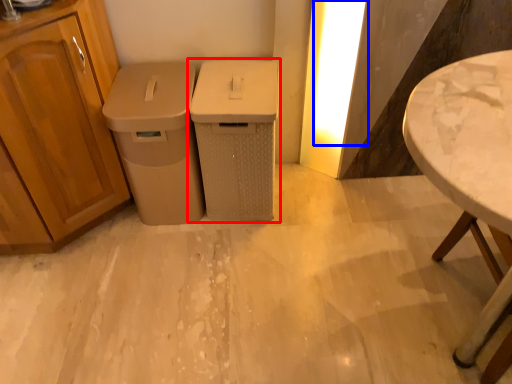
Question: Which object is further to the camera taking this photo, waste container (highlighted by a red box) or light (highlighted by a blue box)?

Choices:
 (A) waste container
 (B) light

Answer: (B)